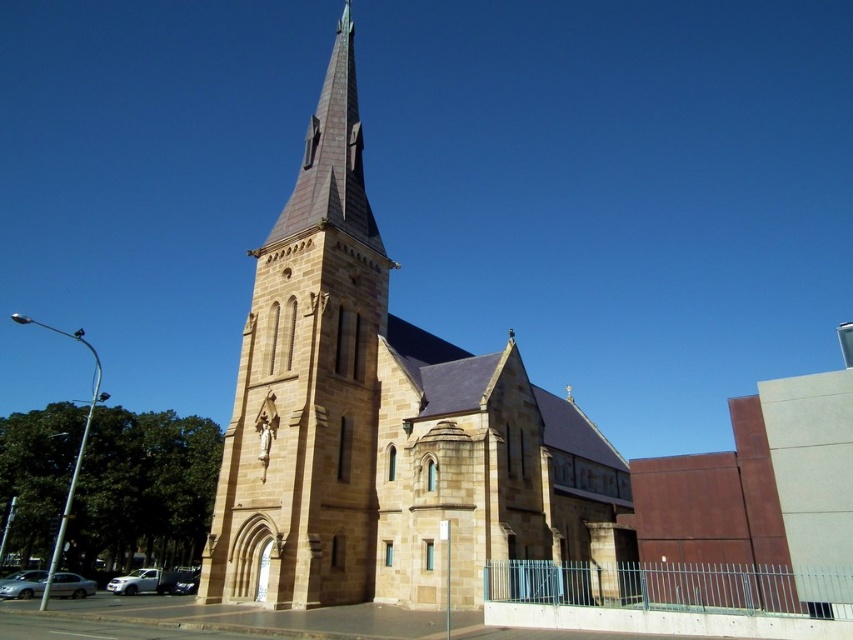
Which of these two, brown stone church at center or brown stone tower at center, stands shorter?

brown stone tower at center is shorter.

Find the location of `brown stone church at center`. brown stone church at center is located at coordinates (384, 420).